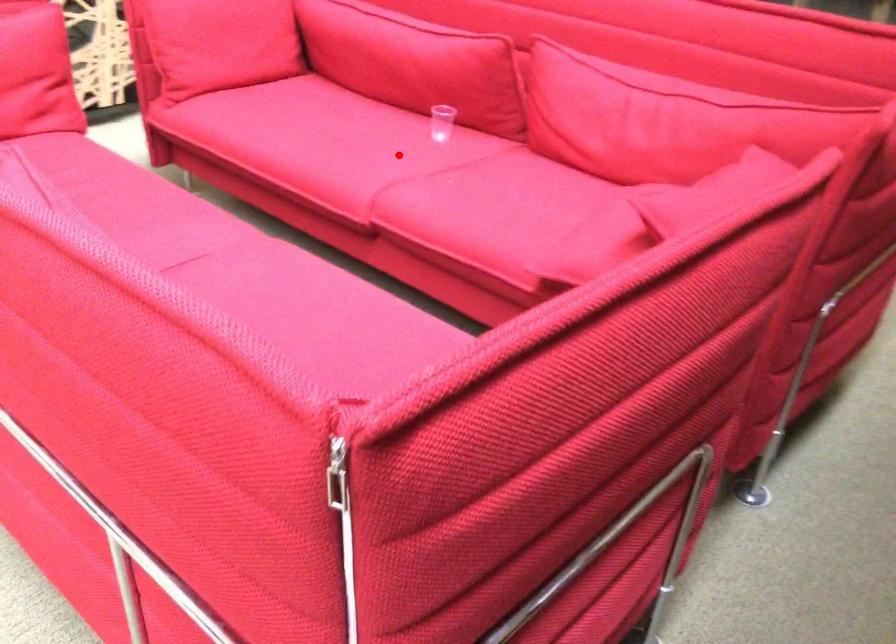
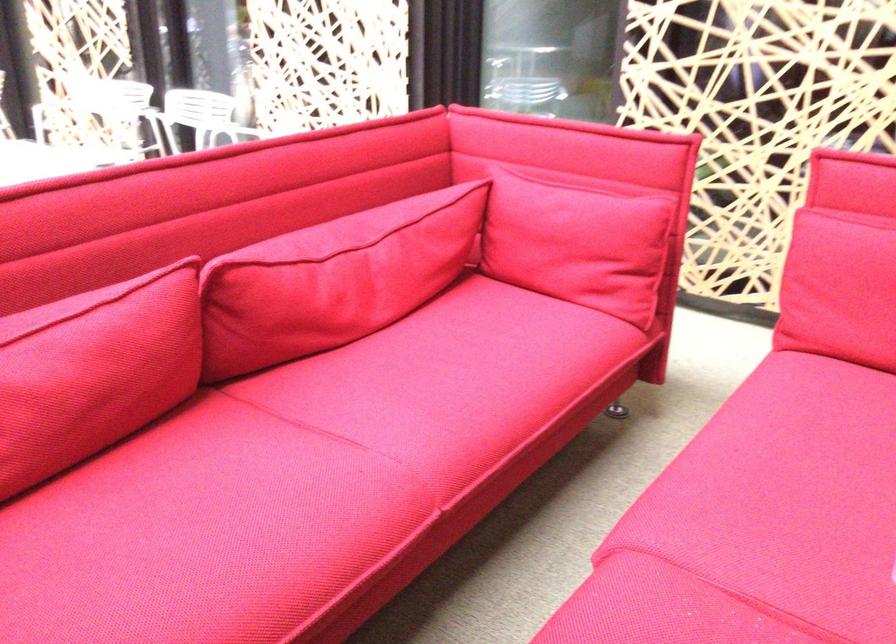
Question: I am providing you with two images of the same scene from different viewpoints. In image1, a red point is highlighted. Considering the same 3D point in image2, which of the following is correct?

Choices:
 (A) It is closer
 (B) It is farther

Answer: (A)